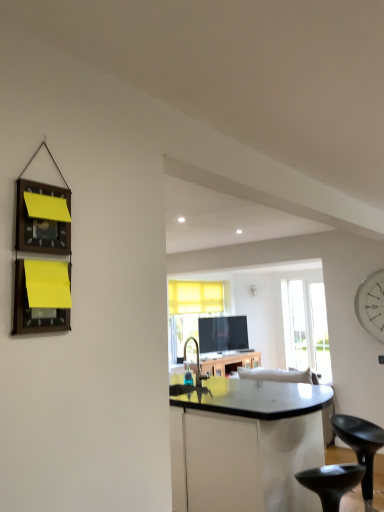
Question: Is black plastic stool at lower right, the second stool in the left-to-right sequence, surrounding wooden frame at left?

Choices:
 (A) no
 (B) yes

Answer: (A)

Question: From a real-world perspective, is black plastic stool at lower right, the second stool in the left-to-right sequence, under wooden frame at left?

Choices:
 (A) yes
 (B) no

Answer: (A)

Question: Is black plastic stool at lower right, the second stool in the left-to-right sequence, next to wooden frame at left?

Choices:
 (A) yes
 (B) no

Answer: (B)

Question: From the image's perspective, is black plastic stool at lower right, the second stool in the left-to-right sequence, below wooden frame at left?

Choices:
 (A) yes
 (B) no

Answer: (A)

Question: Does black plastic stool at lower right, the second stool in the left-to-right sequence, have a smaller size compared to wooden frame at left?

Choices:
 (A) no
 (B) yes

Answer: (A)

Question: Can you confirm if black plastic stool at lower right, the second stool in the left-to-right sequence, is bigger than wooden frame at left?

Choices:
 (A) no
 (B) yes

Answer: (B)

Question: Is black plastic stool at lower right, the 2th stool from the right, positioned behind white glossy clock at right?

Choices:
 (A) yes
 (B) no

Answer: (B)

Question: From a real-world perspective, is black plastic stool at lower right, which is the 1th stool from left to right, on top of white glossy clock at right?

Choices:
 (A) yes
 (B) no

Answer: (B)

Question: Considering the relative sizes of black plastic stool at lower right, which is the 1th stool from left to right, and white glossy clock at right in the image provided, is black plastic stool at lower right, which is the 1th stool from left to right, wider than white glossy clock at right?

Choices:
 (A) no
 (B) yes

Answer: (B)

Question: Considering the relative positions of black plastic stool at lower right, which is the 1th stool from left to right, and white glossy clock at right in the image provided, is black plastic stool at lower right, which is the 1th stool from left to right, to the right of white glossy clock at right from the viewer's perspective?

Choices:
 (A) yes
 (B) no

Answer: (B)

Question: Can you see black plastic stool at lower right, the 2th stool from the right, touching white glossy clock at right?

Choices:
 (A) no
 (B) yes

Answer: (A)

Question: Could you tell me if black plastic stool at lower right, which is the 1th stool from left to right, is turned towards white glossy clock at right?

Choices:
 (A) no
 (B) yes

Answer: (A)

Question: Are transparent glass door at center and black plastic stool at lower right, placed as the 1th stool when sorted from right to left, far apart?

Choices:
 (A) yes
 (B) no

Answer: (A)